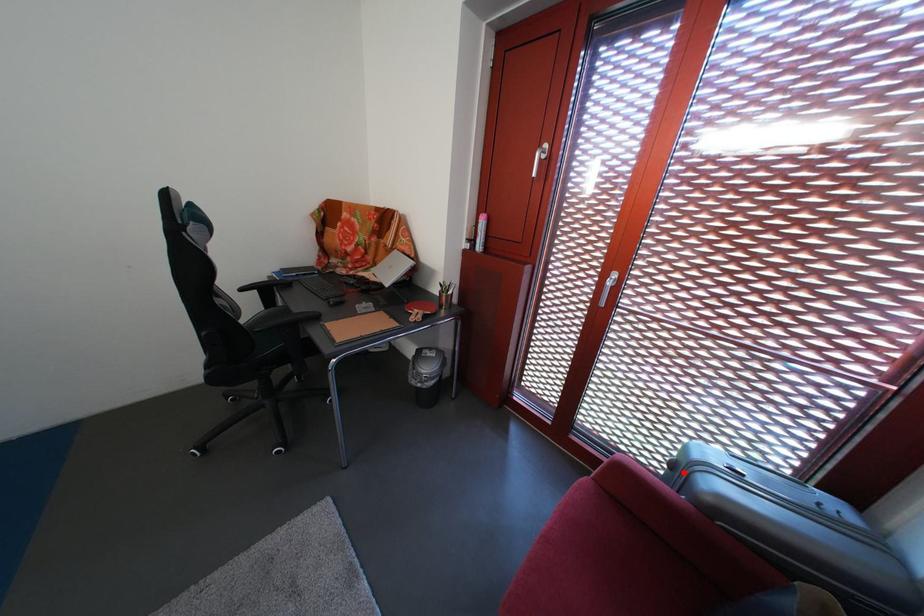
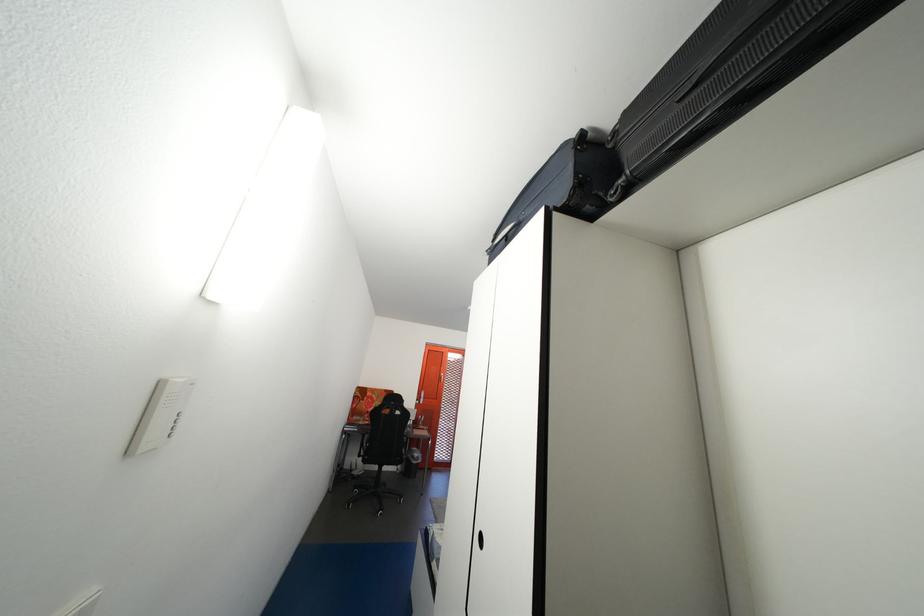
Question: I am providing you with two images of the same scene from different viewpoints. A red point is marked on the first image. Is the red point's position out of view in image 2?

Choices:
 (A) Yes
 (B) No

Answer: (A)